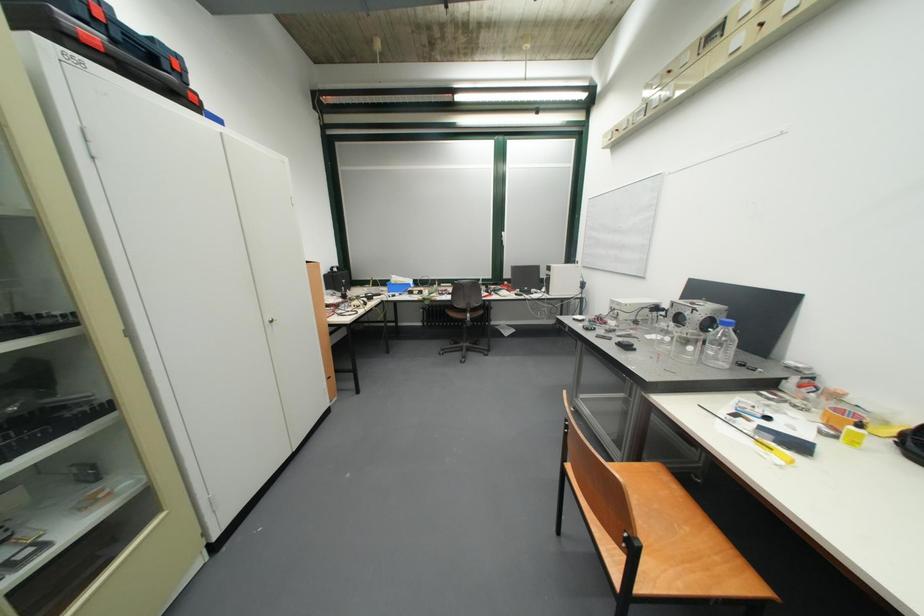
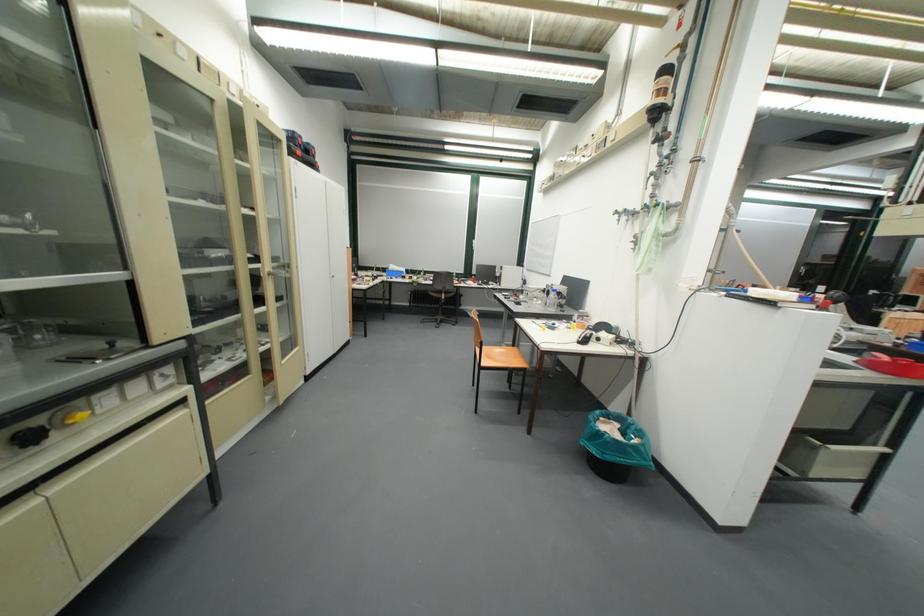
Find the pixel in the second image that matches [476,312] in the first image.

(453, 293)